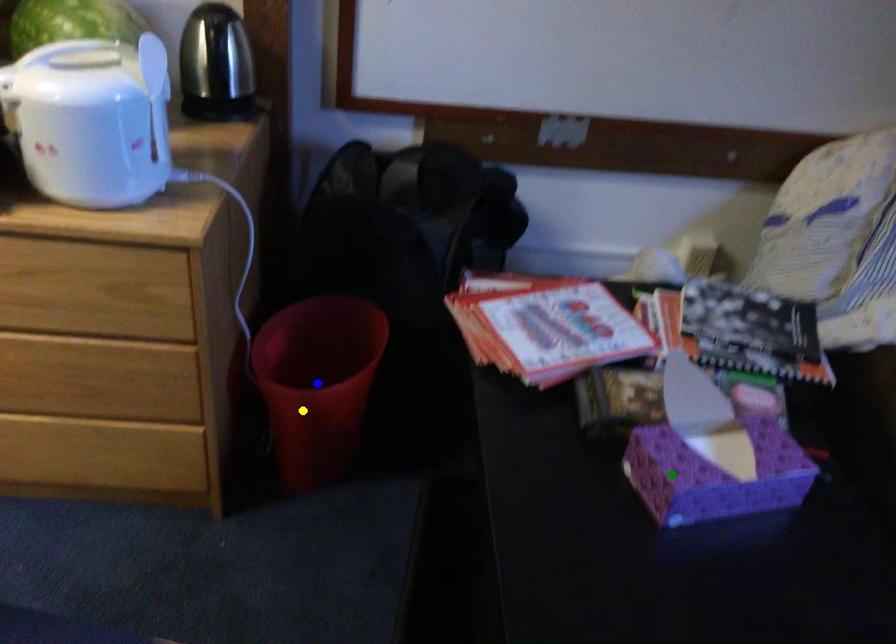
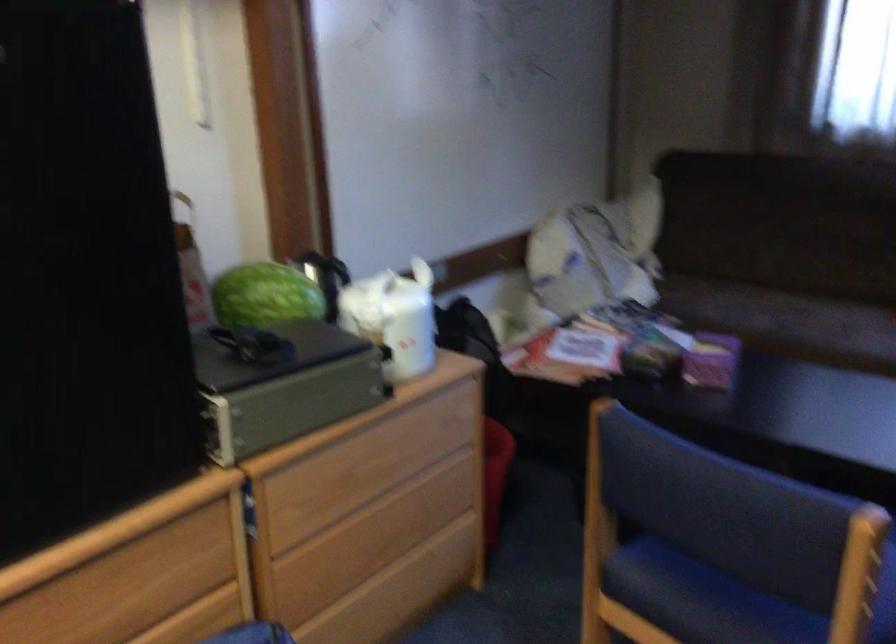
I am providing you with two images of the same scene from different viewpoints. Three points are marked in image1. Which point corresponds to a part or object that is occluded in image2?In image1, three points are marked. Which of them correspond to a part or object that is occluded in image2?Among the three points shown in image1, which one corresponds to a part or object that is no longer visible due to occlusion in image2?

Invisible in image2: blue point.